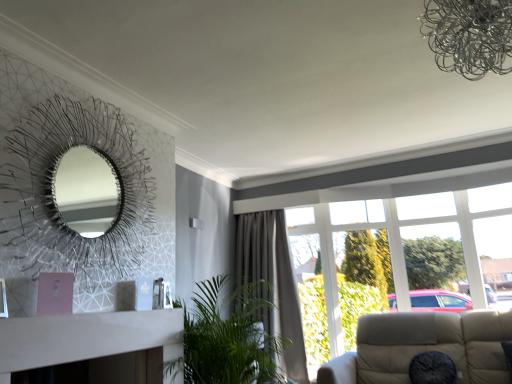
Measure the distance between green leafy plant at center and camera.

8.08 feet.

Describe the element at coordinates (377, 177) in the screenshot. I see `transparent glass window at right` at that location.

What do you see at coordinates (432, 369) in the screenshot? Image resolution: width=512 pixels, height=384 pixels. I see `black fabric cushion at lower right` at bounding box center [432, 369].

This screenshot has height=384, width=512. Describe the element at coordinates (62, 156) in the screenshot. I see `metallic silver fireplace at left` at that location.

Where is `green leafy plant at center`? Image resolution: width=512 pixels, height=384 pixels. green leafy plant at center is located at coordinates (227, 339).

Choose the correct answer: Is gray fabric curtain at center inside black fabric cushion at lower right or outside it?

gray fabric curtain at center is not enclosed by black fabric cushion at lower right.

The width and height of the screenshot is (512, 384). I want to click on curtain on the left of black fabric cushion at lower right, so click(273, 283).

Is gray fabric curtain at center at the left side of black fabric cushion at lower right?

Correct, you'll find gray fabric curtain at center to the left of black fabric cushion at lower right.

From a real-world perspective, who is located higher, metallic silver fireplace at left or black fabric cushion at lower right?

In real-world perspective, metallic silver fireplace at left is above.

Is metallic silver fireplace at left facing towards black fabric cushion at lower right?

No.

Between metallic silver fireplace at left and black fabric cushion at lower right, which one appears on the right side from the viewer's perspective?

black fabric cushion at lower right.

From the image's perspective, is metallic silver fireplace at left above or below black fabric cushion at lower right?

From the image's perspective, metallic silver fireplace at left appears above black fabric cushion at lower right.

Is transparent glass window at right with green leafy plant at center?

No, transparent glass window at right is not next to green leafy plant at center.

Is transparent glass window at right aimed at green leafy plant at center?

Yes, transparent glass window at right is oriented towards green leafy plant at center.

Based on their positions, is transparent glass window at right located to the left or right of green leafy plant at center?

transparent glass window at right is positioned on green leafy plant at center's right side.

From the image's perspective, is transparent glass window at right on top of metallic silver fireplace at left?

No, from the image's perspective, transparent glass window at right is not on top of metallic silver fireplace at left.

From a real-world perspective, is transparent glass window at right under metallic silver fireplace at left?

Yes, from a real-world perspective, transparent glass window at right is under metallic silver fireplace at left.

Is transparent glass window at right bigger than metallic silver fireplace at left?

Yes.

Is metallic silver fireplace at left completely or partially inside black fabric cushion at lower right?

No, metallic silver fireplace at left is not a part of black fabric cushion at lower right.

Locate an element on the screen. oval that is below the metallic silver fireplace at left (from the image's perspective) is located at coordinates (432, 369).

From the image's perspective, which is above, black fabric cushion at lower right or metallic silver fireplace at left?

metallic silver fireplace at left appears higher in the image.

From a real-world perspective, is black fabric cushion at lower right physically located above or below transparent glass window at right?

black fabric cushion at lower right is below transparent glass window at right.

Is black fabric cushion at lower right closer to the viewer compared to transparent glass window at right?

That is True.

Locate an element on the screen. This screenshot has width=512, height=384. oval to the left of transparent glass window at right is located at coordinates (432, 369).

Can you confirm if transparent glass window at right is bigger than black fabric cushion at lower right?

Indeed, transparent glass window at right has a larger size compared to black fabric cushion at lower right.

Is transparent glass window at right turned away from black fabric cushion at lower right?

transparent glass window at right is not turned away from black fabric cushion at lower right.

Which is in front, point (296, 172) or point (414, 373)?

The point (414, 373) is closer to the camera.

Is transparent glass window at right thinner than black fabric cushion at lower right?

No.

The width and height of the screenshot is (512, 384). What are the coordinates of `oval located on the right of gray fabric curtain at center` in the screenshot? It's located at (432, 369).

Where is `fireplace in front of the black fabric cushion at lower right`? fireplace in front of the black fabric cushion at lower right is located at coordinates (62, 156).

From the image, which object appears to be farther from black fabric cushion at lower right, metallic silver fireplace at left or gray fabric curtain at center?

Based on the image, metallic silver fireplace at left appears to be further to black fabric cushion at lower right.

From the image, which object appears to be nearer to metallic silver fireplace at left, gray fabric curtain at center or transparent glass window at right?

Based on the image, gray fabric curtain at center appears to be nearer to metallic silver fireplace at left.

Looking at the image, which one is located closer to gray fabric curtain at center, black fabric cushion at lower right or green leafy plant at center?

The object closer to gray fabric curtain at center is green leafy plant at center.

From the image, which object appears to be nearer to black fabric cushion at lower right, transparent glass window at right or gray fabric curtain at center?

Based on the image, gray fabric curtain at center appears to be nearer to black fabric cushion at lower right.

Based on their spatial positions, is metallic silver fireplace at left or transparent glass window at right further from gray fabric curtain at center?

Based on the image, metallic silver fireplace at left appears to be further to gray fabric curtain at center.

When comparing their distances from gray fabric curtain at center, does metallic silver fireplace at left or black fabric cushion at lower right seem closer?

black fabric cushion at lower right is closer to gray fabric curtain at center.

Based on their spatial positions, is gray fabric curtain at center or green leafy plant at center further from black fabric cushion at lower right?

Based on the image, gray fabric curtain at center appears to be further to black fabric cushion at lower right.

Looking at the image, which one is located further to black fabric cushion at lower right, green leafy plant at center or transparent glass window at right?

Based on the image, transparent glass window at right appears to be further to black fabric cushion at lower right.

Where is `curtain between metallic silver fireplace at left and transparent glass window at right from left to right`? The image size is (512, 384). curtain between metallic silver fireplace at left and transparent glass window at right from left to right is located at coordinates (273, 283).

You are a GUI agent. You are given a task and a screenshot of the screen. Output one action in this format:
    pyautogui.click(x=<x>, y=<y>)
    Task: Click on the houseplant between metallic silver fireplace at left and transparent glass window at right
    Image resolution: width=512 pixels, height=384 pixels.
    Given the screenshot: What is the action you would take?
    pyautogui.click(x=227, y=339)

Where is `curtain situated between metallic silver fireplace at left and black fabric cushion at lower right from left to right`? This screenshot has height=384, width=512. curtain situated between metallic silver fireplace at left and black fabric cushion at lower right from left to right is located at coordinates (273, 283).

Locate an element on the screen. window positioned between green leafy plant at center and gray fabric curtain at center from near to far is located at coordinates (377, 177).